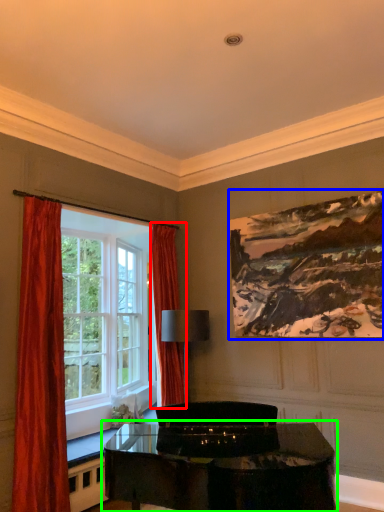
Question: Which object is positioned closest to curtain (highlighted by a red box)? Select from picture frame (highlighted by a blue box) and table (highlighted by a green box).

Choices:
 (A) picture frame
 (B) table

Answer: (A)